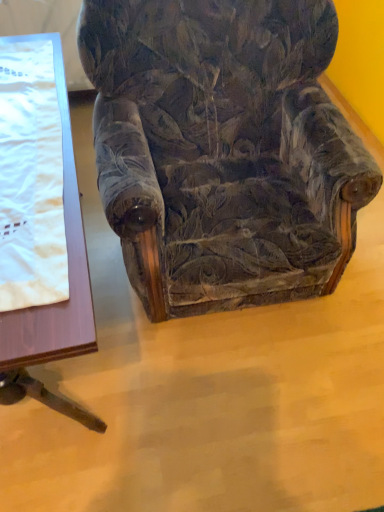
Where is `blank area beneath white satin blanket at left (from a real-world perspective)`? blank area beneath white satin blanket at left (from a real-world perspective) is located at coordinates (36, 164).